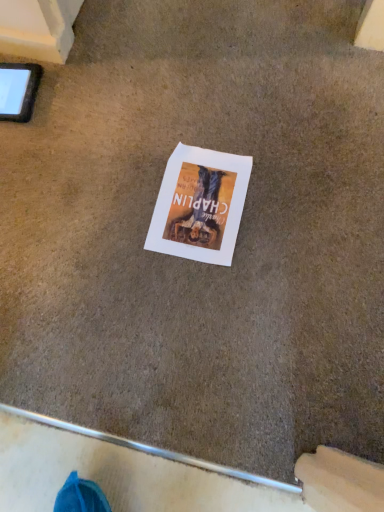
You are a GUI agent. You are given a task and a screenshot of the screen. Output one action in this format:
    pyautogui.click(x=<x>, y=<y>)
    Task: Click on the free space between black matte tablet at upper left and white paper at center
    Image resolution: width=384 pixels, height=512 pixels.
    Given the screenshot: What is the action you would take?
    pyautogui.click(x=93, y=163)